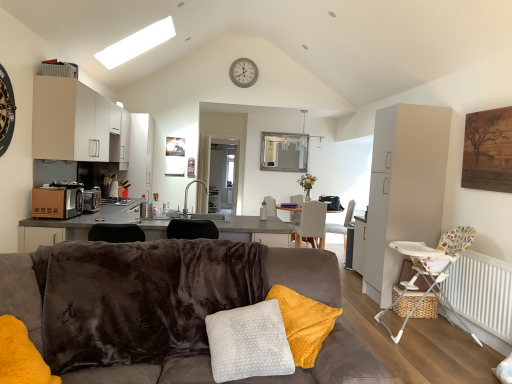
Question: Is matte black toaster at left in front of or behind white textured pillow at center in the image?

Choices:
 (A) behind
 (B) front

Answer: (A)

Question: Is matte black toaster at left wider or thinner than white textured pillow at center?

Choices:
 (A) thin
 (B) wide

Answer: (A)

Question: Which object is positioned farthest from the matte brown microwave at left?

Choices:
 (A) silver metallic faucet at center
 (B) white plastic clock at upper center
 (C) light gray fabric chair at center, which ranks as the 1th chair in back-to-front order
 (D) white textured pillow at center
 (E) white matte cabinet at upper left, arranged as the second cabinetry when viewed from the right

Answer: (C)

Question: Estimate the real-world distances between objects in this image. Which object is closer to the silver metallic faucet at center?

Choices:
 (A) light gray fabric chair at center, the third chair from the front
 (B) white textured pillow at center
 (C) white glossy armchair at center
 (D) white plastic clock at upper center
 (E) matte brown microwave at left

Answer: (E)